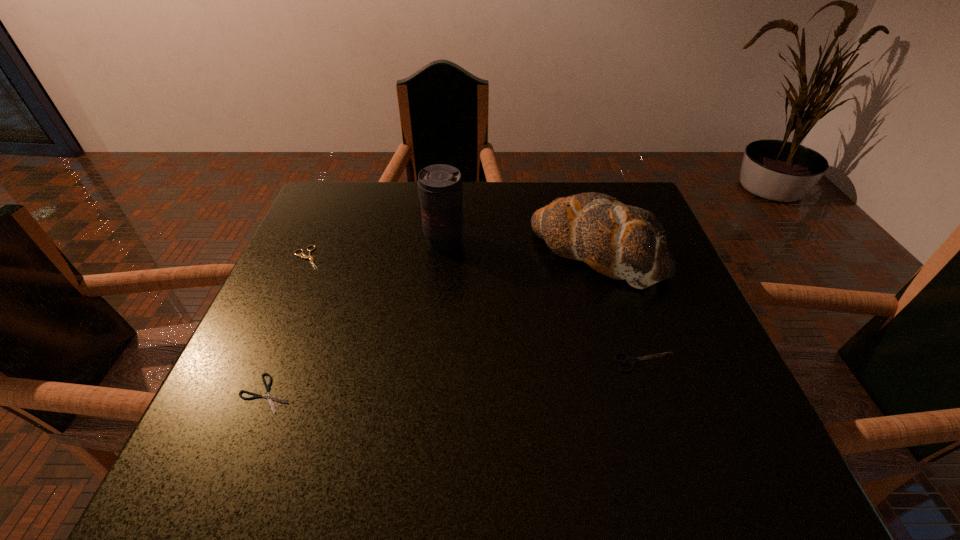
At what (x,y) coordinates should I click in order to perform the action: click on telephoto lens. Please return your answer as a coordinate pair (x, y). The image size is (960, 540). Looking at the image, I should click on (440, 187).

In order to click on the third object from right to left in this screenshot , I will do `click(440, 187)`.

What are the coordinates of `bread` in the screenshot? It's located at (620, 241).

In order to click on the third shortest object in this screenshot , I will do `click(630, 361)`.

Find the location of a particular element. The height and width of the screenshot is (540, 960). the tallest shears is located at coordinates (630, 361).

You are a GUI agent. You are given a task and a screenshot of the screen. Output one action in this format:
    pyautogui.click(x=<x>, y=<y>)
    Task: Click on the second tallest shears
    This screenshot has height=540, width=960.
    Given the screenshot: What is the action you would take?
    pyautogui.click(x=304, y=256)

This screenshot has width=960, height=540. In order to click on the second shortest object in this screenshot , I will do `click(304, 256)`.

Where is `the shortest object`? the shortest object is located at coordinates (268, 396).

Image resolution: width=960 pixels, height=540 pixels. Identify the location of the shortest shears. (268, 396).

At what (x,y) coordinates should I click in order to perform the action: click on vacant space located 0.210m on the side of the third object from left to right where the control switches are located. Please return your answer as a coordinate pair (x, y). Looking at the image, I should click on (437, 320).